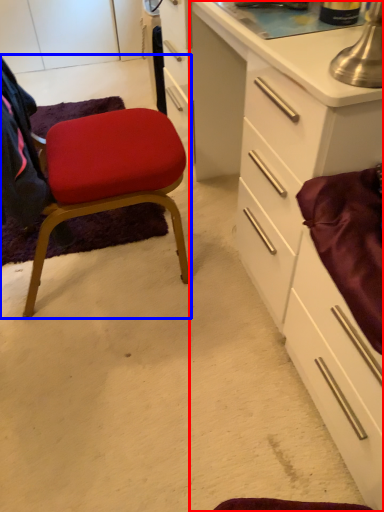
Question: Which point is closer to the camera, cabinetry (highlighted by a red box) or chair (highlighted by a blue box)?

Choices:
 (A) cabinetry
 (B) chair

Answer: (A)